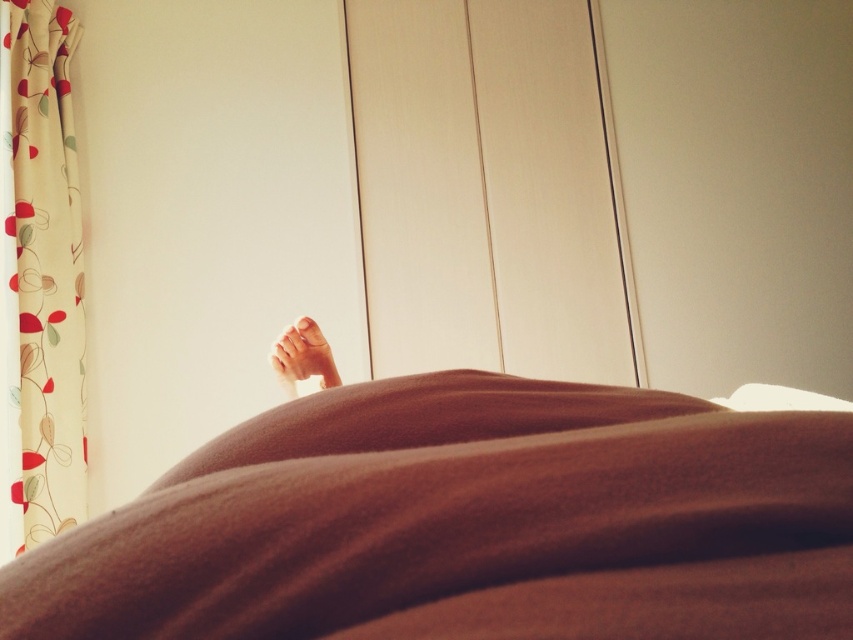
Does brown soft fabric at lower center appear on the right side of floral fabric curtain at left?

Indeed, brown soft fabric at lower center is positioned on the right side of floral fabric curtain at left.

Can you confirm if brown soft fabric at lower center is wider than floral fabric curtain at left?

Yes, brown soft fabric at lower center is wider than floral fabric curtain at left.

Which is behind, point (178, 604) or point (18, 202)?

The point (18, 202) is behind.

Locate an element on the screen. The width and height of the screenshot is (853, 640). brown soft fabric at lower center is located at coordinates click(468, 524).

Can you confirm if brown soft fabric at lower center is positioned below smooth skin foot at center?

Correct, brown soft fabric at lower center is located below smooth skin foot at center.

Does brown soft fabric at lower center have a lesser width compared to smooth skin foot at center?

In fact, brown soft fabric at lower center might be wider than smooth skin foot at center.

This screenshot has height=640, width=853. Find the location of `brown soft fabric at lower center`. brown soft fabric at lower center is located at coordinates (468, 524).

How far apart are floral fabric curtain at left and smooth skin foot at center?

1.29 meters

Is floral fabric curtain at left in front of smooth skin foot at center?

No, it is not.

Between point (38, 285) and point (288, 392), which one is positioned in front?

Point (288, 392) is more forward.

What are the coordinates of `floral fabric curtain at left` in the screenshot? It's located at (45, 269).